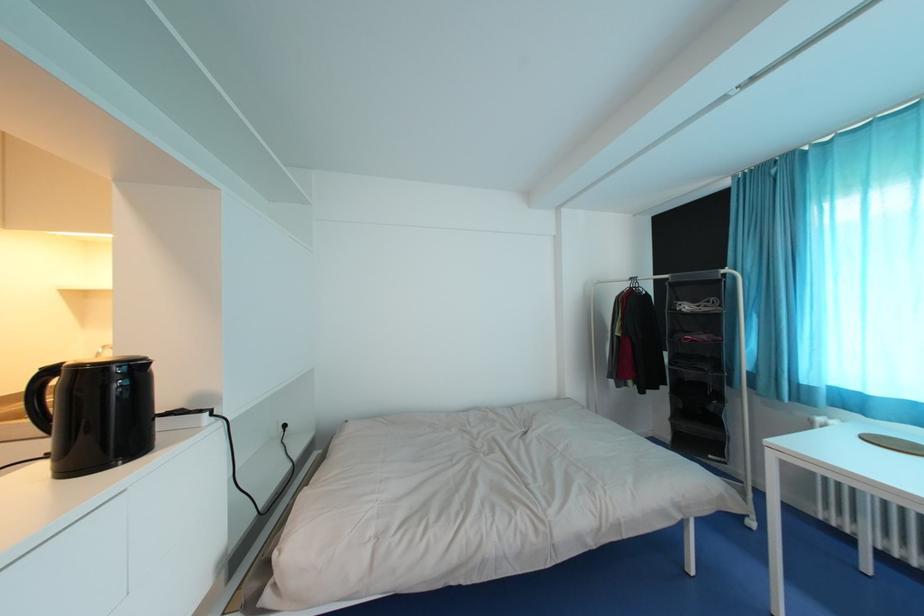
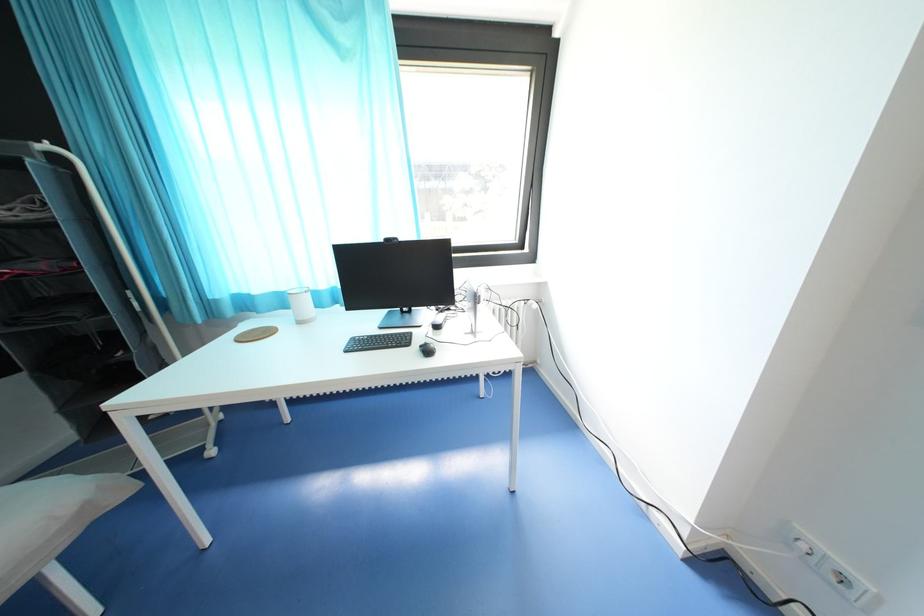
First-person continuous shooting, in which direction is the camera rotating?

The camera's rotation is toward right-down.